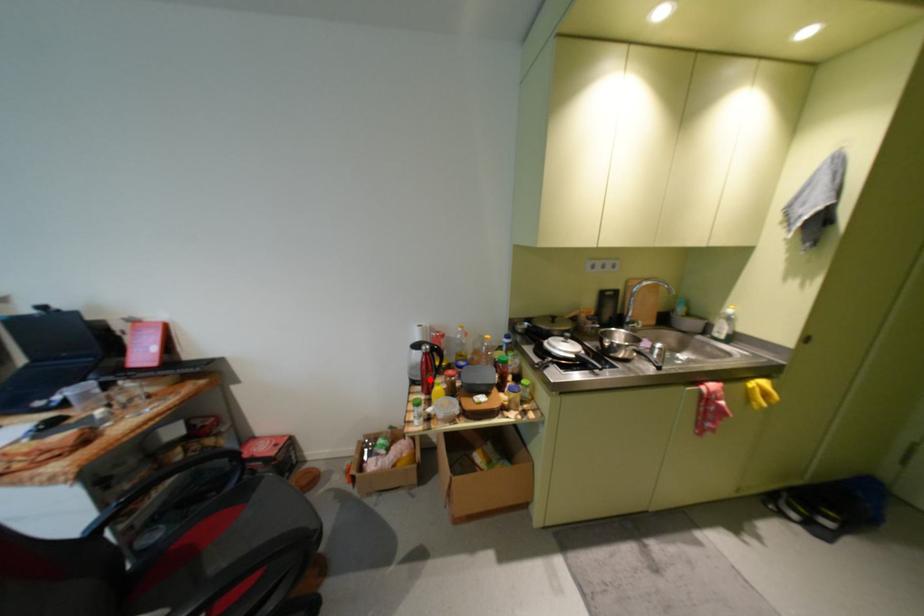
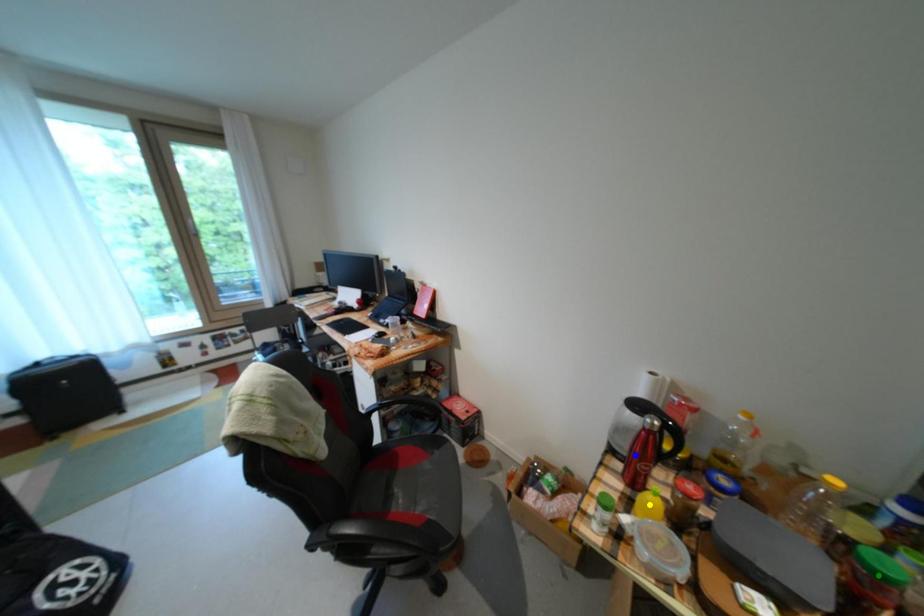
Question: I am providing you with two images of the same scene from different viewpoints. A red point is marked on the first image. You are given multiple points on the second image. Which point in image 2 is actually the same real-world point as the red point in image 1?

Choices:
 (A) green point
 (B) yellow point
 (C) blue point

Answer: (C)